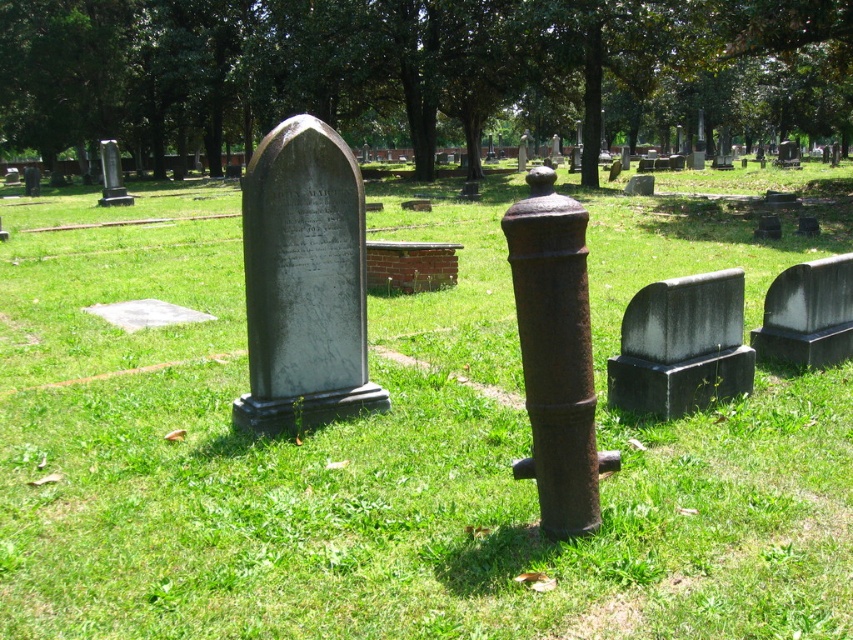
Is black marble gravestone at lower right to the right of brick at center from the viewer's perspective?

Indeed, black marble gravestone at lower right is positioned on the right side of brick at center.

Does black marble gravestone at lower right have a lesser height compared to brick at center?

In fact, black marble gravestone at lower right may be taller than brick at center.

Find the location of a particular element. The image size is (853, 640). black marble gravestone at lower right is located at coordinates (682, 346).

At what (x,y) coordinates should I click in order to perform the action: click on black marble gravestone at lower right. Please return your answer as a coordinate pair (x, y). Looking at the image, I should click on (682, 346).

Does point (534, 339) come closer to viewer compared to point (660, 340)?

Yes, it is in front of point (660, 340).

Between rusty metal pole at center and black marble gravestone at lower right, which one is positioned higher?

rusty metal pole at center is above.

Is point (560, 502) behind point (669, 328)?

No, it is not.

This screenshot has width=853, height=640. Identify the location of rusty metal pole at center. (555, 355).

Does point (274, 358) come in front of point (440, 288)?

Yes, point (274, 358) is in front of point (440, 288).

Can you confirm if gray polished stone gravestone at center is bigger than brick at center?

Yes.

Which is behind, point (363, 333) or point (368, 264)?

Positioned behind is point (368, 264).

At what (x,y) coordinates should I click in order to perform the action: click on gray polished stone gravestone at center. Please return your answer as a coordinate pair (x, y). This screenshot has width=853, height=640. Looking at the image, I should click on (305, 282).